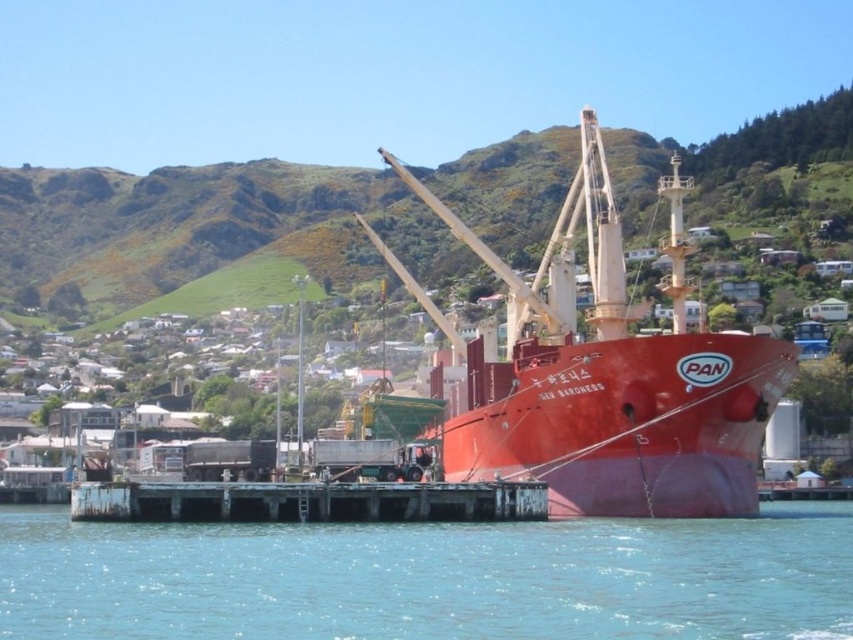
Is clear blue water at lower center thinner than rusty metal dock at lower center?

Incorrect, clear blue water at lower center's width is not less than rusty metal dock at lower center's.

Can you confirm if clear blue water at lower center is positioned to the left of rusty metal dock at lower center?

In fact, clear blue water at lower center is to the right of rusty metal dock at lower center.

Which is behind, point (717, 624) or point (247, 504)?

Point (247, 504)

The image size is (853, 640). In order to click on clear blue water at lower center in this screenshot , I will do point(431,579).

Measure the distance between point (442, 568) and camera.

They are 67.33 meters apart.

Which is behind, point (146, 596) or point (509, 301)?

Point (509, 301)

I want to click on clear blue water at lower center, so click(x=431, y=579).

Does clear blue water at lower center have a larger size compared to green grassy hillside at upper center?

No.

Is point (323, 634) positioned before point (22, 280)?

Yes, it is.

Is point (28, 529) closer to camera compared to point (228, 252)?

Yes, it is.

Locate an element on the screen. clear blue water at lower center is located at coordinates (431, 579).